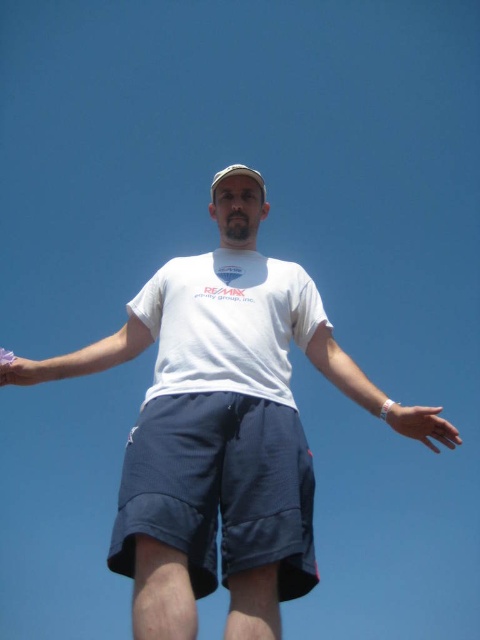
Based on the scene description, can you determine which object has a bigger size between the matte white hand at lower right and the white matte wristband at lower center?

The matte white hand at lower right has a larger size compared to the white matte wristband at lower center according to the description.